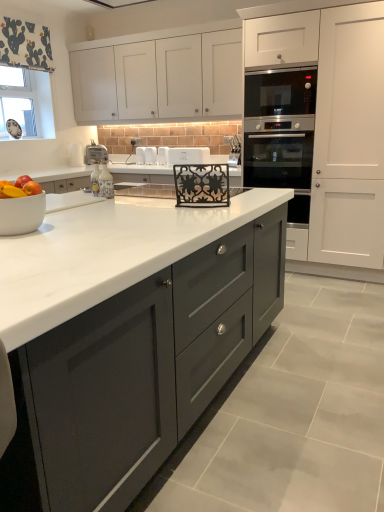
Question: Does porcelain bottle at center, the second appliance in the front-to-back sequence, have a lesser width compared to white plastic toaster at center, which is counted as the 1th appliance, starting from the back?

Choices:
 (A) yes
 (B) no

Answer: (A)

Question: Can you confirm if porcelain bottle at center, the seventh appliance positioned from the back, is smaller than white plastic toaster at center, the 1th appliance from the left?

Choices:
 (A) yes
 (B) no

Answer: (A)

Question: Does porcelain bottle at center, the third appliance when ordered from left to right, have a larger size compared to white plastic toaster at center, which is the eighth appliance in front-to-back order?

Choices:
 (A) yes
 (B) no

Answer: (B)

Question: From a real-world perspective, is porcelain bottle at center, marked as the sixth appliance in a right-to-left arrangement, under white plastic toaster at center, the 1th appliance from the left?

Choices:
 (A) yes
 (B) no

Answer: (A)

Question: From the image's perspective, is porcelain bottle at center, the third appliance when ordered from left to right, on top of white plastic toaster at center, which is counted as the 1th appliance, starting from the back?

Choices:
 (A) yes
 (B) no

Answer: (B)

Question: Visually, is white plastic toaster at center, the 1th appliance from the left, positioned to the left or to the right of red matte apple at left?

Choices:
 (A) left
 (B) right

Answer: (A)

Question: From a real-world perspective, is white plastic toaster at center, which appears as the eighth appliance when viewed from the right, positioned above or below red matte apple at left?

Choices:
 (A) below
 (B) above

Answer: (A)

Question: Which is correct: white plastic toaster at center, which is counted as the 1th appliance, starting from the back, is inside red matte apple at left, or outside of it?

Choices:
 (A) inside
 (B) outside

Answer: (B)

Question: Considering the positions of white plastic toaster at center, the 1th appliance from the left, and red matte apple at left in the image, is white plastic toaster at center, the 1th appliance from the left, wider or thinner than red matte apple at left?

Choices:
 (A) wide
 (B) thin

Answer: (A)

Question: From a real-world perspective, relative to white plastic toaster at center, the 6th appliance viewed from the front, is white fabric at upper left vertically above or below?

Choices:
 (A) above
 (B) below

Answer: (A)

Question: In the image, is white fabric at upper left on the left side or the right side of white plastic toaster at center, placed as the third appliance when sorted from back to front?

Choices:
 (A) left
 (B) right

Answer: (A)

Question: Considering the positions of white fabric at upper left and white plastic toaster at center, placed as the third appliance when sorted from back to front, in the image, is white fabric at upper left taller or shorter than white plastic toaster at center, placed as the third appliance when sorted from back to front,?

Choices:
 (A) tall
 (B) short

Answer: (A)

Question: Is point tap(18, 70) closer or farther from the camera than point tap(165, 148)?

Choices:
 (A) farther
 (B) closer

Answer: (A)

Question: From a real-world perspective, relative to stainless steel oven at right, is white matte oven at upper right, marked as the 3th cabinetry in a left-to-right arrangement, vertically above or below?

Choices:
 (A) below
 (B) above

Answer: (B)

Question: Is point [x=289, y=26] positioned closer to the camera than point [x=296, y=106]?

Choices:
 (A) closer
 (B) farther

Answer: (A)